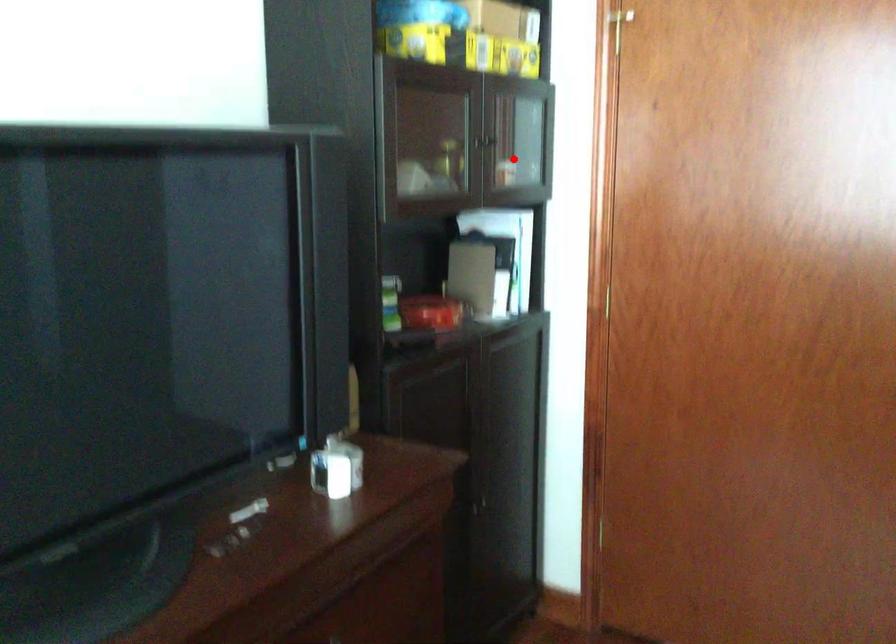
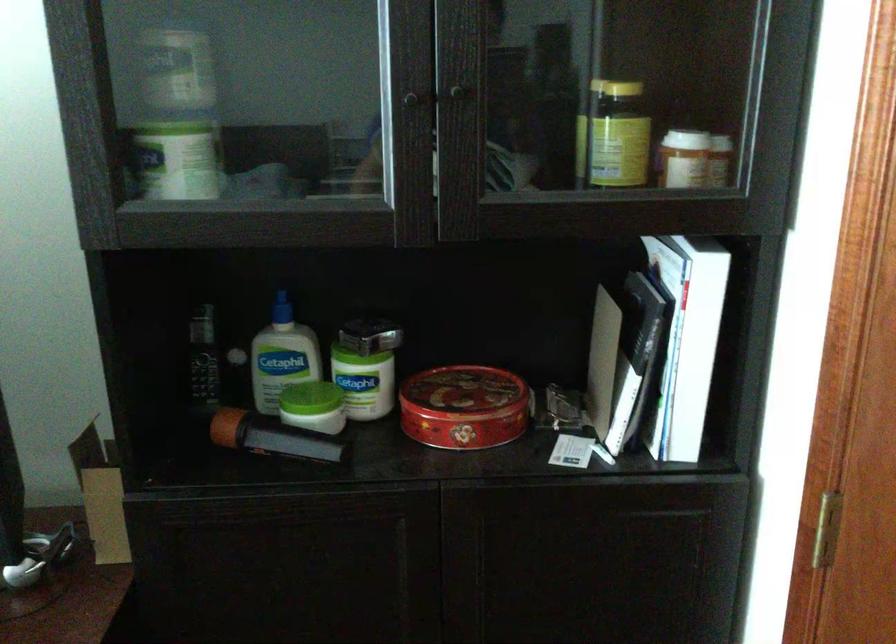
Find the pixel in the second image that matches the highlighted location in the first image.

(686, 135)